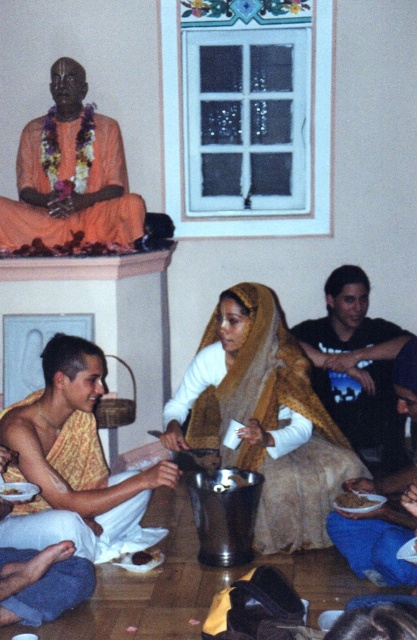
Is point (346, 289) more distant than point (338, 541)?

Yes, it is.

Based on the photo, who is positioned more to the left, black cotton shirt at lower right or blue fabric cloth at lower right?

From the viewer's perspective, blue fabric cloth at lower right appears more on the left side.

What are the coordinates of `black cotton shirt at lower right` in the screenshot? It's located at (356, 369).

The image size is (417, 640). What do you see at coordinates (73, 464) in the screenshot?
I see `yellow-orange sari at lower left` at bounding box center [73, 464].

Is yellow-orange sari at lower left bigger than black cotton shirt at lower right?

Correct, yellow-orange sari at lower left is larger in size than black cotton shirt at lower right.

This screenshot has width=417, height=640. In order to click on yellow-orange sari at lower left in this screenshot , I will do `click(73, 464)`.

Does point (389, 406) lie in front of point (353, 492)?

That is False.

Where is `black cotton shirt at lower right`? This screenshot has height=640, width=417. black cotton shirt at lower right is located at coordinates (356, 369).